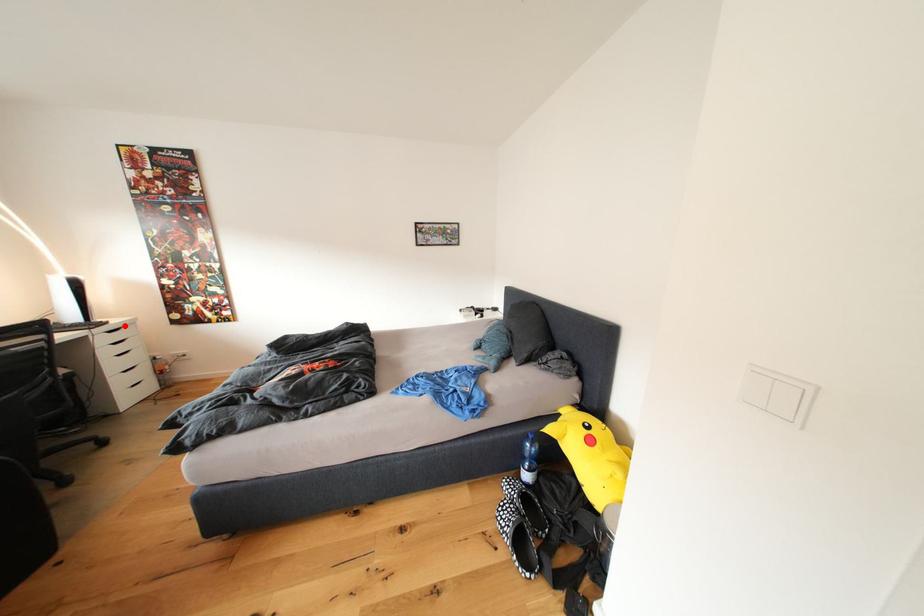
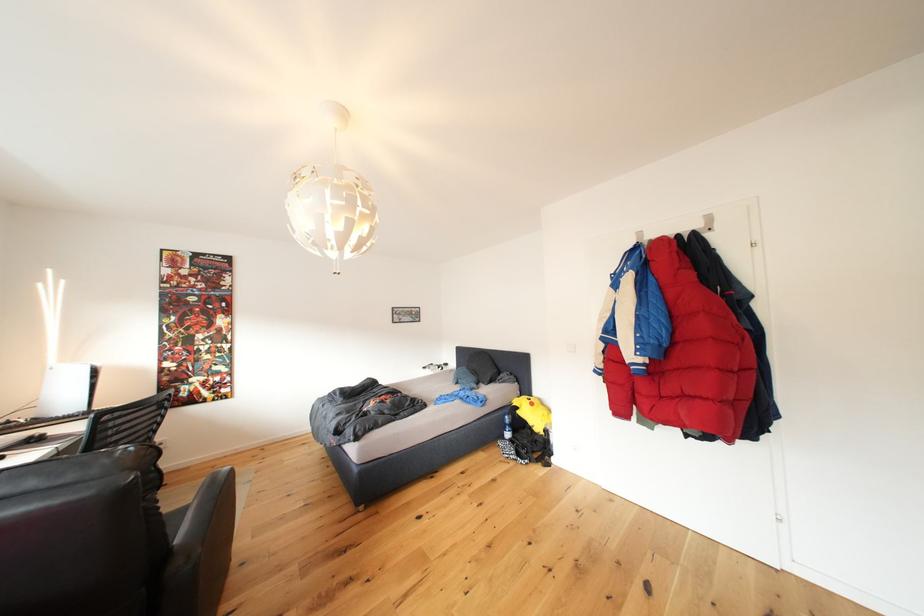
Question: I am providing you with two images of the same scene from different viewpoints. A red point is marked on the first image. At the location where the point appears in image 1, is it still visible in image 2?

Choices:
 (A) Yes
 (B) No

Answer: (B)